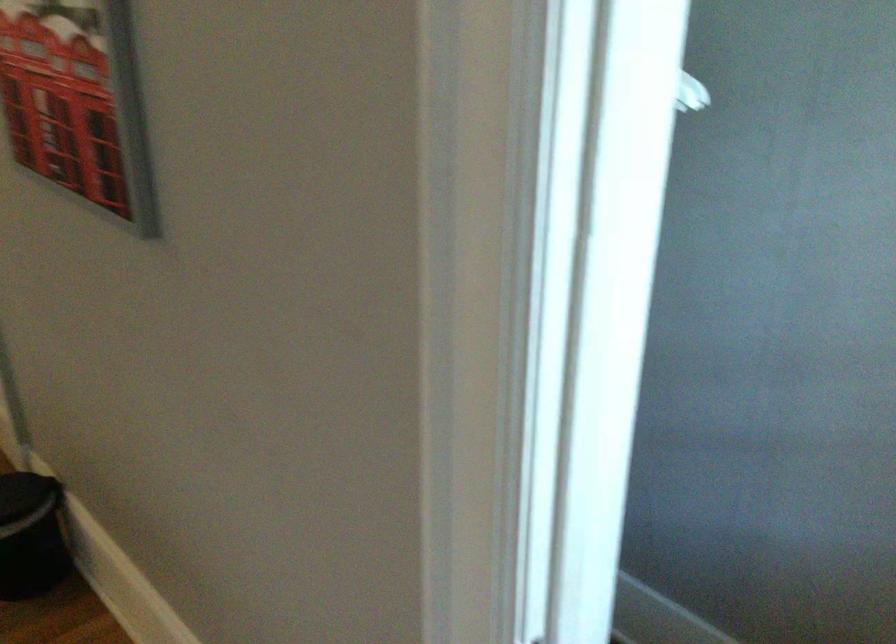
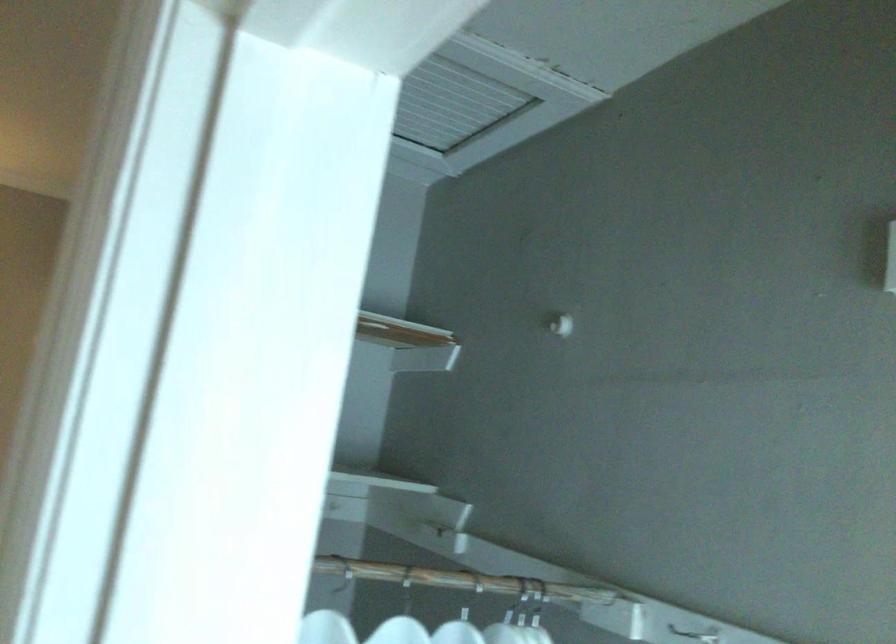
First-person continuous shooting, in which direction is the camera rotating?

The camera rotated toward left-up.